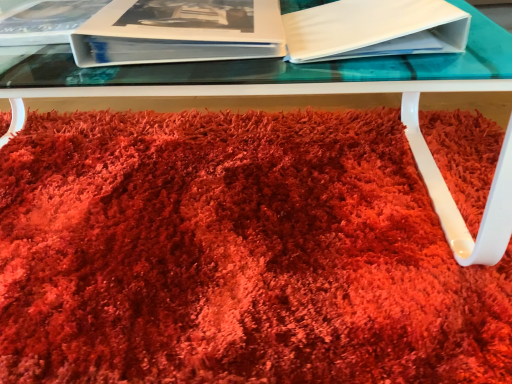
Question: Can white matte book at upper right, which is the second paperback book in left-to-right order, be found inside shaggy red carpet at center?

Choices:
 (A) no
 (B) yes

Answer: (A)

Question: Does shaggy red carpet at center have a larger size compared to white matte book at upper right, the 1th paperback book from the right?

Choices:
 (A) yes
 (B) no

Answer: (A)

Question: Is shaggy red carpet at center looking in the opposite direction of white matte book at upper right, the 1th paperback book from the right?

Choices:
 (A) no
 (B) yes

Answer: (A)

Question: Can you confirm if shaggy red carpet at center is taller than white matte book at upper right, which is the second paperback book in left-to-right order?

Choices:
 (A) yes
 (B) no

Answer: (B)

Question: Is the position of shaggy red carpet at center less distant than that of white matte book at upper right, which is the second paperback book in left-to-right order?

Choices:
 (A) no
 (B) yes

Answer: (B)

Question: From the image's perspective, is white matte book at upper right, the 1th paperback book from the right, positioned above or below white glossy album at upper left?

Choices:
 (A) above
 (B) below

Answer: (B)

Question: Which is correct: white matte book at upper right, which is the second paperback book in left-to-right order, is inside white glossy album at upper left, or outside of it?

Choices:
 (A) inside
 (B) outside

Answer: (B)

Question: From a real-world perspective, is white matte book at upper right, which is the second paperback book in left-to-right order, physically located above or below white glossy album at upper left?

Choices:
 (A) above
 (B) below

Answer: (A)

Question: Is white matte book at upper right, which is the second paperback book in left-to-right order, taller or shorter than white glossy album at upper left?

Choices:
 (A) tall
 (B) short

Answer: (A)

Question: Which is correct: white glossy book at upper left, the second paperback book viewed from the right, is inside white glossy album at upper left, or outside of it?

Choices:
 (A) outside
 (B) inside

Answer: (A)

Question: From the image's perspective, is white glossy book at upper left, the second paperback book viewed from the right, above or below white glossy album at upper left?

Choices:
 (A) below
 (B) above

Answer: (A)

Question: From a real-world perspective, relative to white glossy album at upper left, is white glossy book at upper left, the second paperback book viewed from the right, vertically above or below?

Choices:
 (A) above
 (B) below

Answer: (A)

Question: In terms of height, does white glossy book at upper left, the second paperback book viewed from the right, look taller or shorter compared to white glossy album at upper left?

Choices:
 (A) short
 (B) tall

Answer: (B)

Question: Looking at the image, does shaggy red carpet at center seem bigger or smaller compared to white glossy book at upper left, the second paperback book viewed from the right?

Choices:
 (A) big
 (B) small

Answer: (A)

Question: In terms of width, does shaggy red carpet at center look wider or thinner when compared to white glossy book at upper left, the second paperback book viewed from the right?

Choices:
 (A) wide
 (B) thin

Answer: (A)